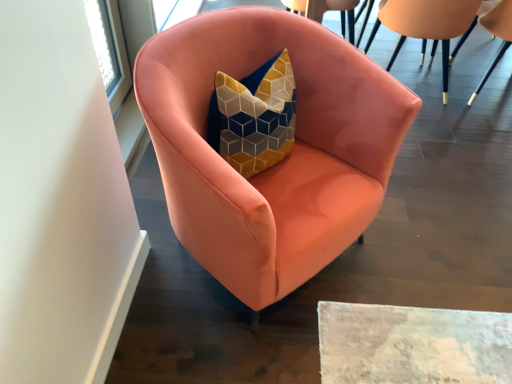
Question: Is matte pink armchair at upper right, the second chair from the right, in front of or behind matte pink armchair at center, the 3th chair when ordered from right to left, in the image?

Choices:
 (A) front
 (B) behind

Answer: (B)

Question: Is matte pink armchair at upper right, the second chair from the right, wider or thinner than matte pink armchair at center, the 3th chair when ordered from right to left?

Choices:
 (A) thin
 (B) wide

Answer: (A)

Question: Considering the real-world distances, which object is farthest from the matte pink armchair at upper right, which ranks as the 3th chair in left-to-right order?

Choices:
 (A) matte pink armchair at center, the 3th chair when ordered from right to left
 (B) matte pink armchair at upper right, the second chair from the right

Answer: (A)

Question: Estimate the real-world distances between objects in this image. Which object is farther from the matte pink armchair at upper right, marked as the 1th chair in a right-to-left arrangement?

Choices:
 (A) matte pink armchair at center, the 3th chair when ordered from right to left
 (B) matte pink armchair at upper right, the 2th chair in the left-to-right sequence

Answer: (A)